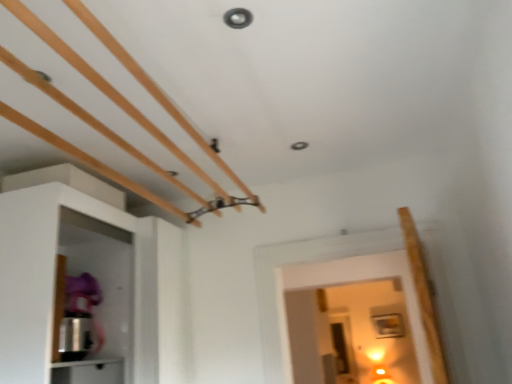
Question: Considering the relative sizes of white matte cabinet at left, the second cabinetry from the bottom, and white glossy cabinet at lower left, the first cabinetry from the bottom, in the image provided, is white matte cabinet at left, the second cabinetry from the bottom, thinner than white glossy cabinet at lower left, the first cabinetry from the bottom,?

Choices:
 (A) yes
 (B) no

Answer: (B)

Question: From a real-world perspective, is white matte cabinet at left, which appears as the 1th cabinetry when viewed from the top, under white glossy cabinet at lower left, the first cabinetry from the bottom?

Choices:
 (A) yes
 (B) no

Answer: (B)

Question: Is white matte cabinet at left, the second cabinetry from the bottom, facing away from white glossy cabinet at lower left, the first cabinetry from the bottom?

Choices:
 (A) yes
 (B) no

Answer: (A)

Question: From the image's perspective, is white matte cabinet at left, which appears as the 1th cabinetry when viewed from the top, on top of white glossy cabinet at lower left, the first cabinetry from the bottom?

Choices:
 (A) no
 (B) yes

Answer: (B)

Question: Is white matte cabinet at left, which appears as the 1th cabinetry when viewed from the top, to the left of white glossy cabinet at lower left, the second cabinetry viewed from the top, from the viewer's perspective?

Choices:
 (A) no
 (B) yes

Answer: (B)

Question: Is white matte cabinet at left, the second cabinetry from the bottom, shorter than white glossy cabinet at lower left, the first cabinetry from the bottom?

Choices:
 (A) no
 (B) yes

Answer: (A)

Question: From a real-world perspective, does white glossy cabinet at lower left, the first cabinetry from the bottom, sit lower than white matte cabinet at left, which appears as the 1th cabinetry when viewed from the top?

Choices:
 (A) yes
 (B) no

Answer: (A)

Question: Considering the relative positions of white glossy cabinet at lower left, the first cabinetry from the bottom, and white matte cabinet at left, the second cabinetry from the bottom, in the image provided, is white glossy cabinet at lower left, the first cabinetry from the bottom, to the right of white matte cabinet at left, the second cabinetry from the bottom, from the viewer's perspective?

Choices:
 (A) yes
 (B) no

Answer: (A)

Question: Is white glossy cabinet at lower left, the second cabinetry viewed from the top, bigger than white matte cabinet at left, the second cabinetry from the bottom?

Choices:
 (A) no
 (B) yes

Answer: (A)

Question: Is white glossy cabinet at lower left, the first cabinetry from the bottom, to the left of white matte cabinet at left, the second cabinetry from the bottom, from the viewer's perspective?

Choices:
 (A) no
 (B) yes

Answer: (A)

Question: From a real-world perspective, is white glossy cabinet at lower left, the second cabinetry viewed from the top, over white matte cabinet at left, which appears as the 1th cabinetry when viewed from the top?

Choices:
 (A) yes
 (B) no

Answer: (B)

Question: Is white glossy cabinet at lower left, the first cabinetry from the bottom, shorter than white matte cabinet at left, the second cabinetry from the bottom?

Choices:
 (A) yes
 (B) no

Answer: (A)

Question: Is white matte cabinet at left, the second cabinetry from the bottom, taller or shorter than white glossy cabinet at lower left, the first cabinetry from the bottom?

Choices:
 (A) tall
 (B) short

Answer: (A)